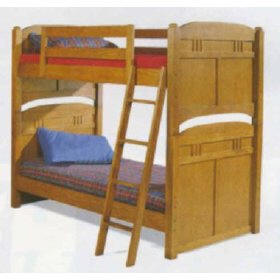
Image resolution: width=280 pixels, height=280 pixels. I want to click on red mattress, so click(x=144, y=60).